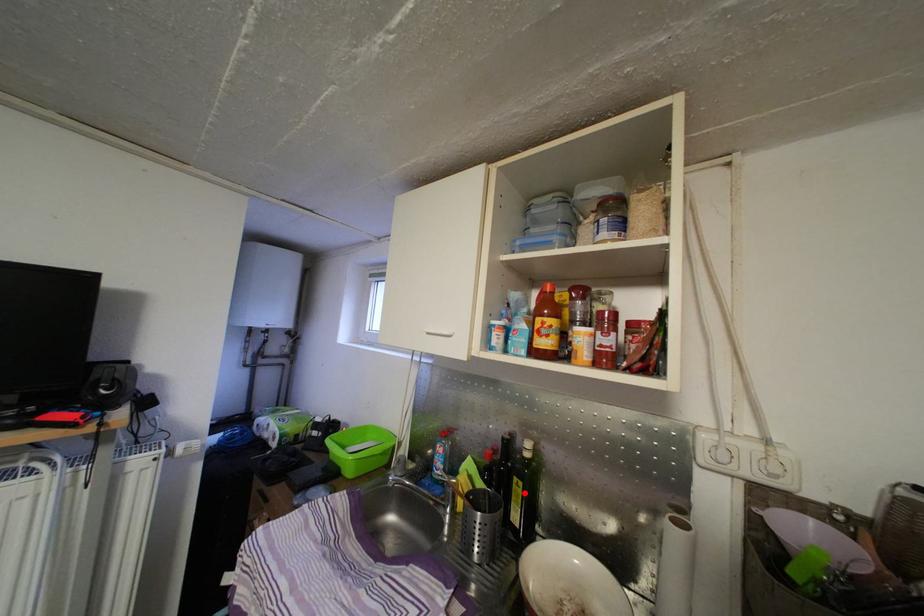
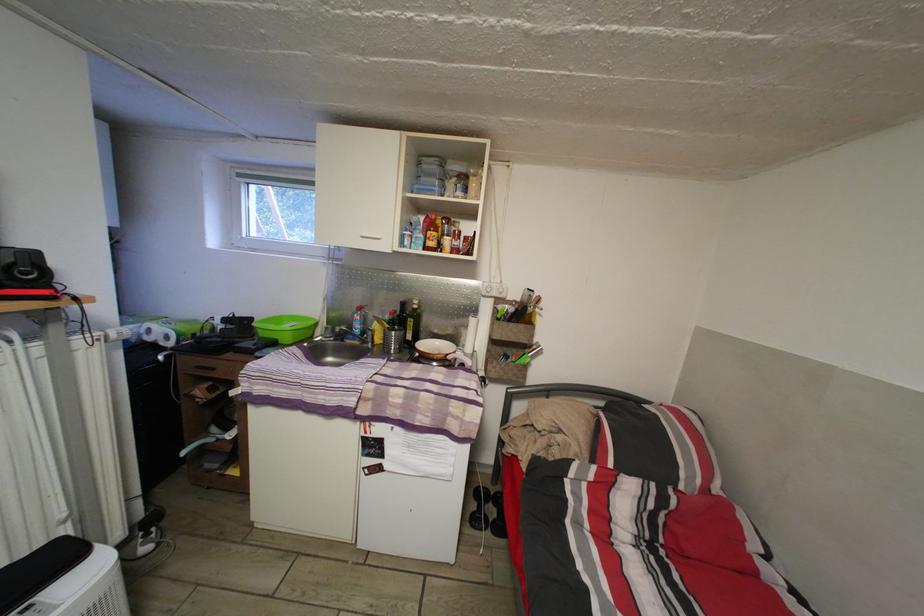
Find the pixel in the second image that matches the highlighted location in the first image.

(418, 329)